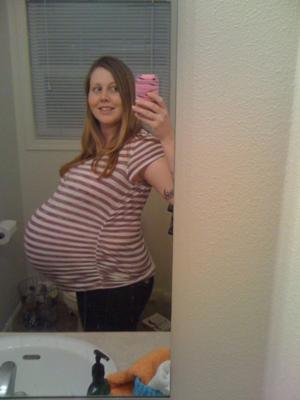
This screenshot has height=400, width=300. In order to click on sink in this screenshot , I will do `click(65, 355)`.